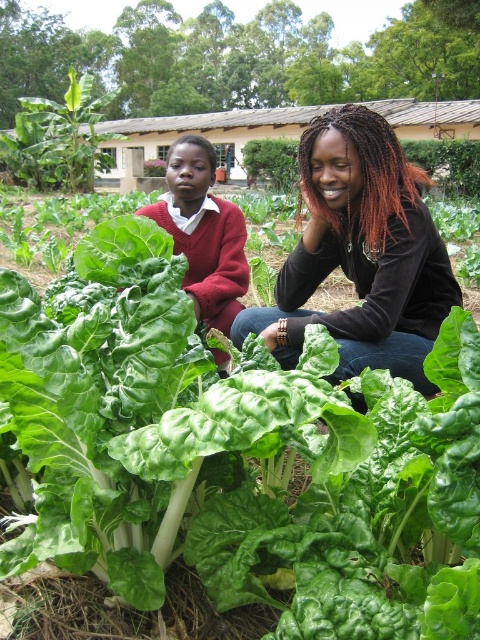
You are a tailor who needs to determine which garment requires more fabric for alterations. Based on the image, which one has a greater width between the black matte shirt at center and the matte red sweater at center?

The black matte shirt at center has a greater width than the matte red sweater at center, so it requires more fabric for alterations.

You are standing in the garden and want to place a small flag at each of the two points marked in the image. Which point, point 1 at coordinates (379, 196) or point 2 at coordinates (197, 280), is closer to you so you can plant the flag first?

Point 1 at coordinates (379, 196) is closer to the viewer than point 2 at coordinates (197, 280), so you should plant the flag at point 1 first.

Consider the image. You are a photographer trying to capture a portrait of both individuals in the scene. Since you want to ensure both are centered in the frame, you need to adjust your camera angle. Based on their positions, which direction should you tilt the camera to include both the black matte shirt at center and the matte red sweater at center in the frame?

The black matte shirt at center is to the right of the matte red sweater at center. To include both in the frame, tilt the camera to the right to capture the black matte shirt at center and the matte red sweater at center.